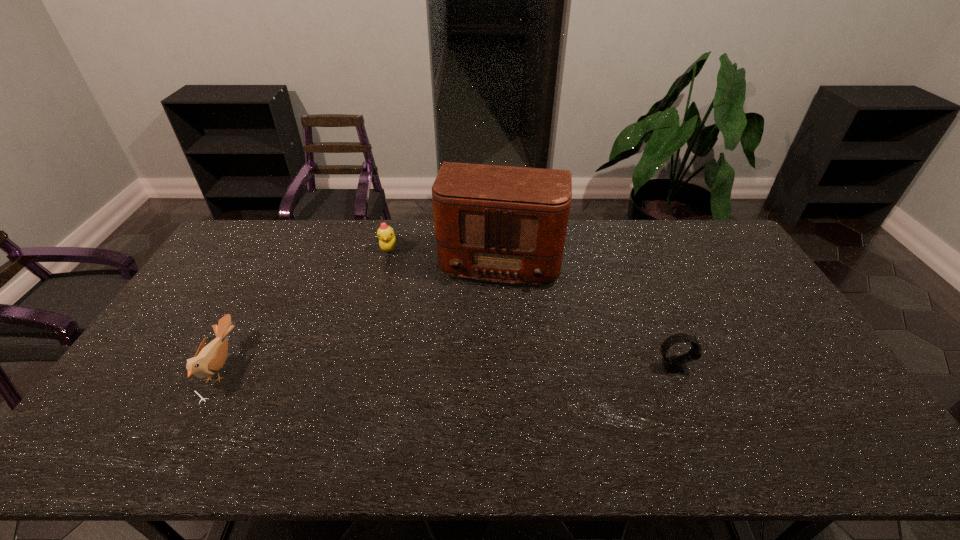
Image resolution: width=960 pixels, height=540 pixels. Identify the location of free spot on the desktop that is between the leftmost object and the rightmost object and is positioned on the front panel of the second object from right to left. (479, 367).

Where is `free space on the desktop that is between the leftmost object and the watch and is positioned on the front-facing side of the third object from right to left`? This screenshot has height=540, width=960. free space on the desktop that is between the leftmost object and the watch and is positioned on the front-facing side of the third object from right to left is located at coordinates tap(468, 367).